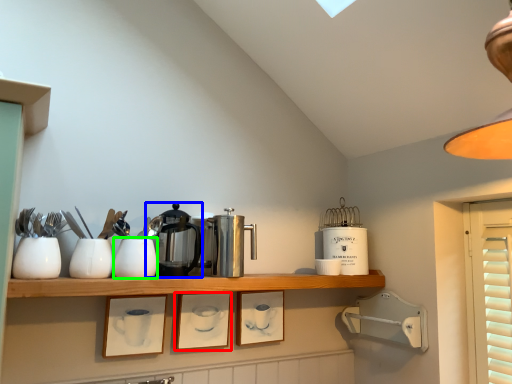
Question: Which object is positioned farthest from picture frame (highlighted by a red box)? Select from coffeepot (highlighted by a blue box) and tableware (highlighted by a green box).

Choices:
 (A) coffeepot
 (B) tableware

Answer: (B)